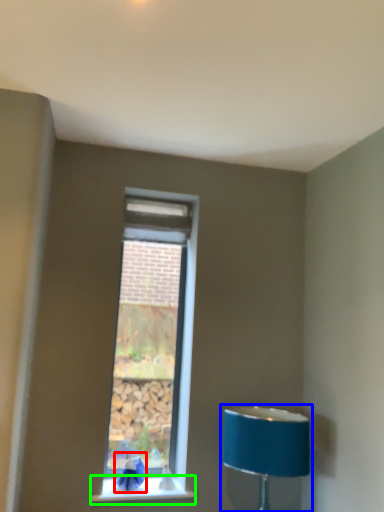
Question: Estimate the real-world distances between objects in this image. Which object is farther from swivel chair (highlighted by a red box), lamp (highlighted by a blue box) or window sill (highlighted by a green box)?

Choices:
 (A) lamp
 (B) window sill

Answer: (A)